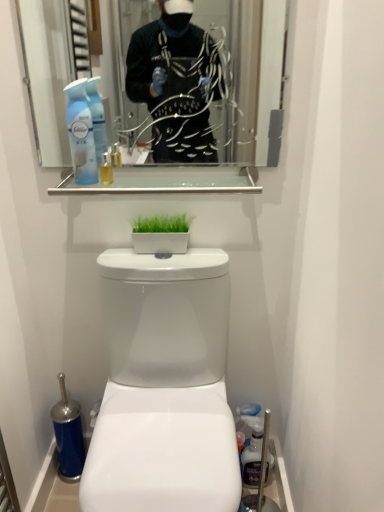
Question: Considering the positions of white glossy toilet at center and clear glass mirror at upper center in the image, is white glossy toilet at center bigger or smaller than clear glass mirror at upper center?

Choices:
 (A) small
 (B) big

Answer: (B)

Question: Do you think white glossy toilet at center is within clear glass mirror at upper center, or outside of it?

Choices:
 (A) outside
 (B) inside

Answer: (A)

Question: Which is nearer to the translucent plastic spray bottle at upper left?

Choices:
 (A) white glossy toilet at center
 (B) clear glass mirror at upper center
 (C) clear glass shelf at upper center
 (D) white glossy planter at center

Answer: (C)

Question: Which object is the farthest from the white glossy toilet at center?

Choices:
 (A) clear glass mirror at upper center
 (B) clear glass shelf at upper center
 (C) translucent plastic spray bottle at upper left
 (D) white glossy planter at center

Answer: (A)